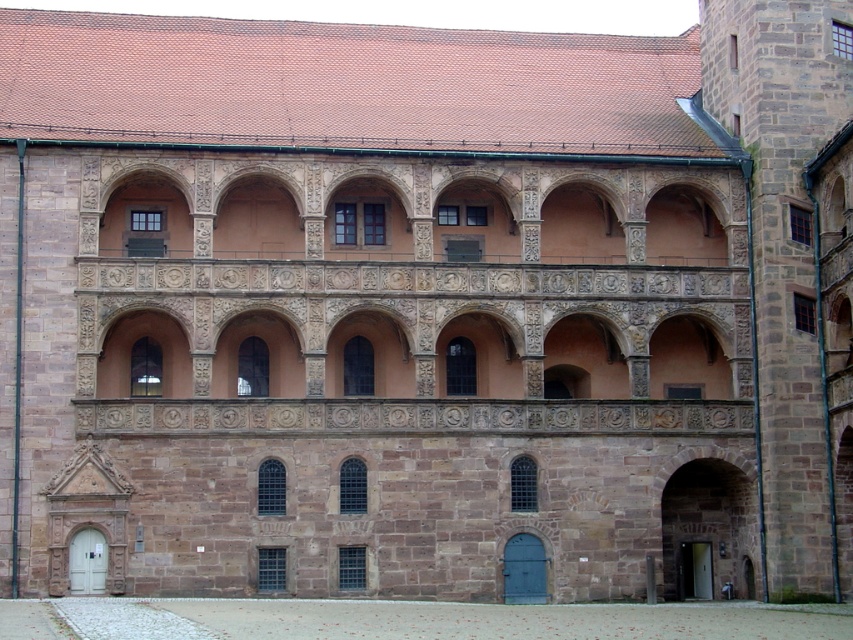
Question: Is smooth gravel courtyard at lower center to the right of stone archway at lower right from the viewer's perspective?

Choices:
 (A) yes
 (B) no

Answer: (B)

Question: Is smooth gravel courtyard at lower center positioned in front of stone archway at lower right?

Choices:
 (A) yes
 (B) no

Answer: (A)

Question: Which point appears farthest from the camera in this image?

Choices:
 (A) (717, 484)
 (B) (561, 627)

Answer: (A)

Question: Is smooth gravel courtyard at lower center further to the viewer compared to stone archway at lower right?

Choices:
 (A) yes
 (B) no

Answer: (B)

Question: Which object is farther from the camera taking this photo?

Choices:
 (A) stone archway at lower right
 (B) smooth gravel courtyard at lower center

Answer: (A)